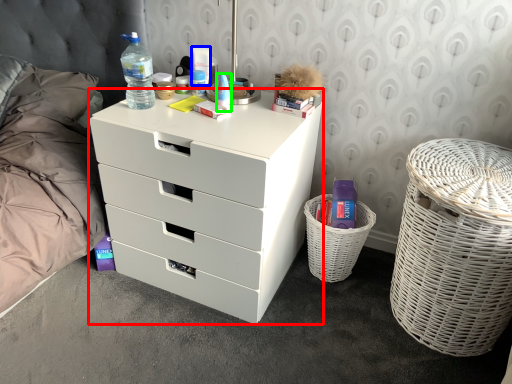
Question: Based on their relative distances, which object is nearer to chest of drawers (highlighted by a red box)? Choose from toiletry (highlighted by a blue box) and toiletry (highlighted by a green box).

Choices:
 (A) toiletry
 (B) toiletry

Answer: (B)